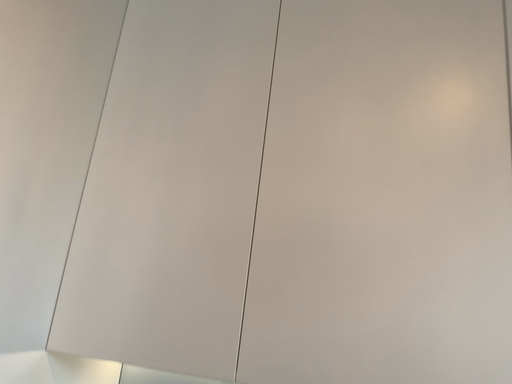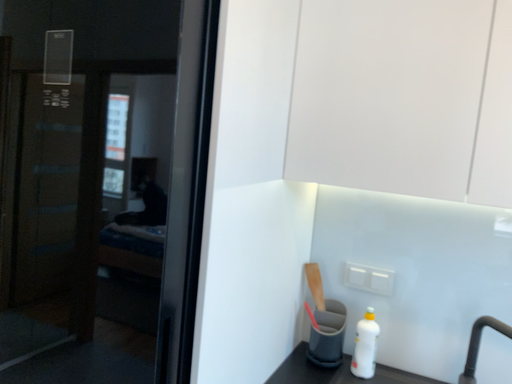
Question: Which way did the camera rotate in the video?

Choices:
 (A) rotated upward
 (B) rotated downward

Answer: (B)